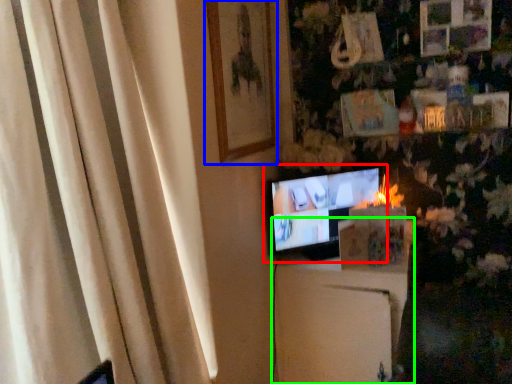
Question: Which object is positioned farthest from television (highlighted by a red box)? Select from picture frame (highlighted by a blue box) and furniture (highlighted by a green box).

Choices:
 (A) picture frame
 (B) furniture

Answer: (A)